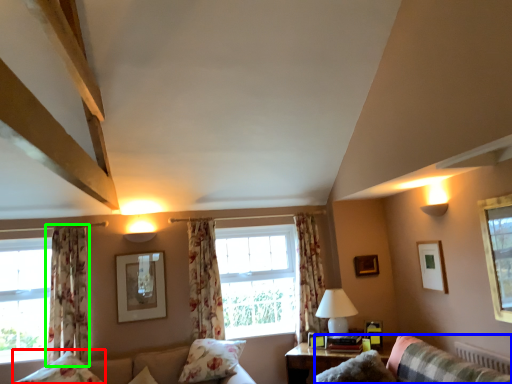
Question: Considering the real-world distances, which object is closest to pillow (highlighted by a red box)? couch (highlighted by a blue box) or curtain (highlighted by a green box).

Choices:
 (A) couch
 (B) curtain

Answer: (B)